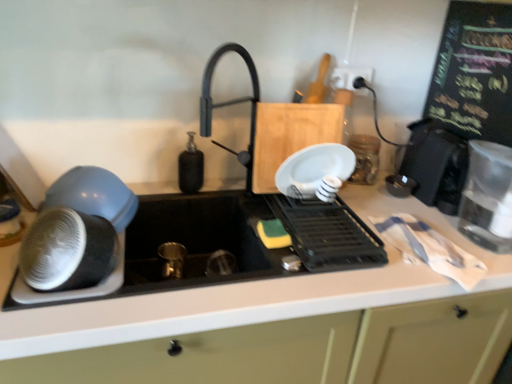
Identify the location of vacant area that is in front of black plastic dish rack at center, positioned as the second appliance in left-to-right order. The image size is (512, 384). (287, 292).